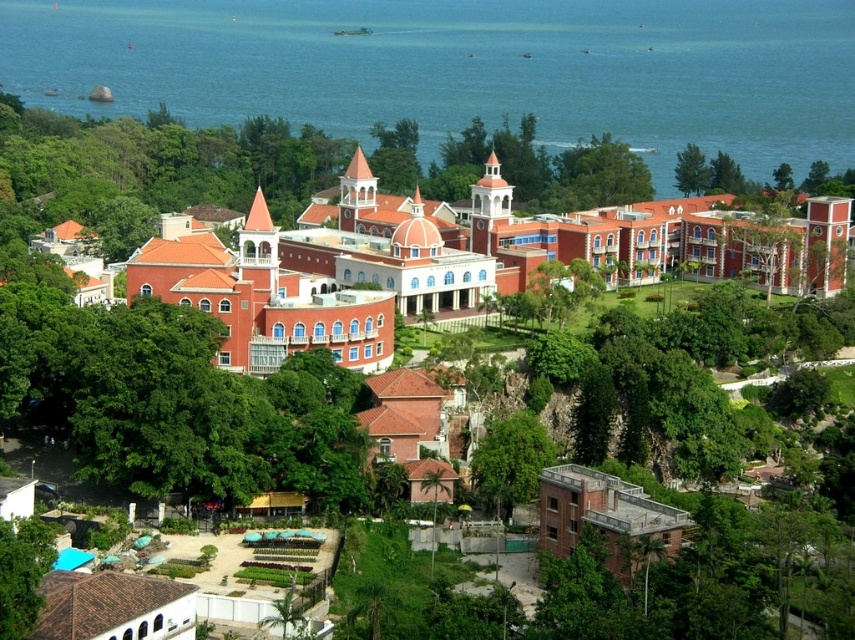
Question: Does blue water at upper center have a larger size compared to green leafy tree at lower left?

Choices:
 (A) no
 (B) yes

Answer: (B)

Question: Which point is farther to the camera?

Choices:
 (A) (444, 6)
 (B) (9, 531)
 (C) (506, 461)

Answer: (A)

Question: Which point is closer to the camera?

Choices:
 (A) (12, 524)
 (B) (522, 474)
 (C) (374, 61)

Answer: (A)

Question: Is blue water at upper center thinner than green leafy tree at upper right?

Choices:
 (A) yes
 (B) no

Answer: (B)

Question: Which point is closer to the camera?

Choices:
 (A) green leafy tree at upper right
 (B) green leafy tree at center
 (C) blue water at upper center

Answer: (B)

Question: Is green leafy tree at center positioned at the back of green leafy tree at lower left?

Choices:
 (A) no
 (B) yes

Answer: (B)